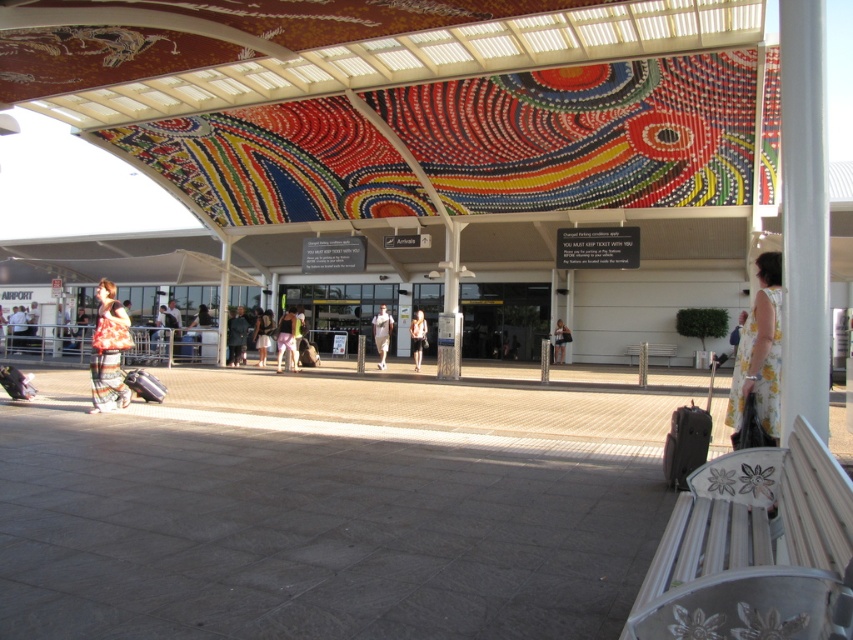
Which is more to the right, matte black suitcase at lower right or matte black suitcase at lower left?

Positioned to the right is matte black suitcase at lower right.

You are a GUI agent. You are given a task and a screenshot of the screen. Output one action in this format:
    pyautogui.click(x=<x>, y=<y>)
    Task: Click on the matte black suitcase at lower right
    The height and width of the screenshot is (640, 853).
    Given the screenshot: What is the action you would take?
    pyautogui.click(x=688, y=440)

Looking at this image, who is positioned more to the right, dark gray fabric pants at center or white matte shirt at center?

Positioned to the right is white matte shirt at center.

What do you see at coordinates (236, 337) in the screenshot? The width and height of the screenshot is (853, 640). I see `dark gray fabric pants at center` at bounding box center [236, 337].

Identify the location of dark gray fabric pants at center. (236, 337).

What do you see at coordinates (286, 339) in the screenshot? This screenshot has height=640, width=853. I see `light brown fabric dress at center` at bounding box center [286, 339].

You are a GUI agent. You are given a task and a screenshot of the screen. Output one action in this format:
    pyautogui.click(x=<x>, y=<y>)
    Task: Click on the light brown fabric dress at center
    The height and width of the screenshot is (640, 853).
    Given the screenshot: What is the action you would take?
    pyautogui.click(x=286, y=339)